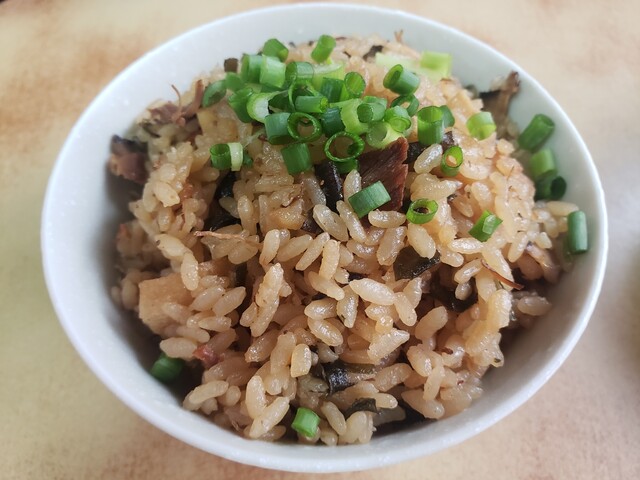
Identify the location of white bowl. This screenshot has width=640, height=480. (70, 264).